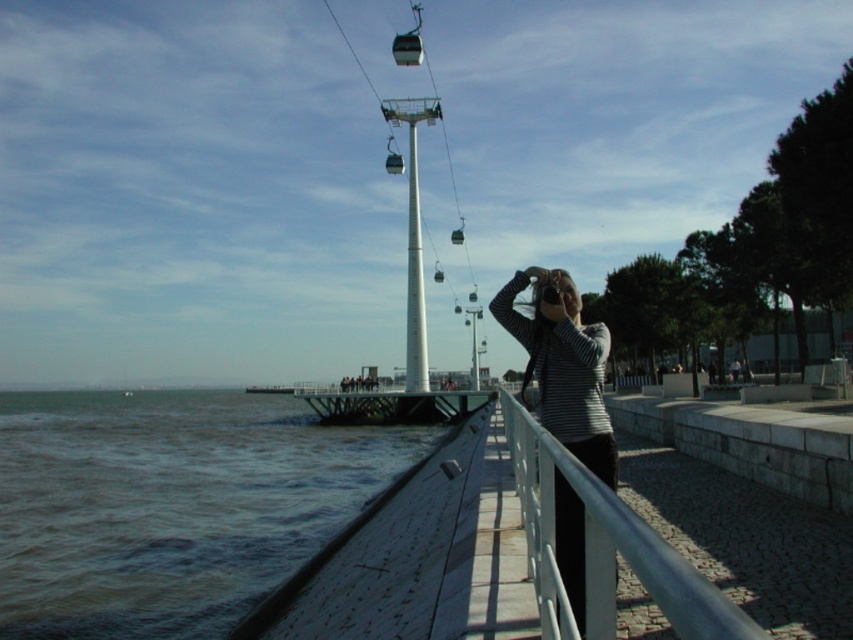
Consider the image. Does brown water at lower left appear over striped fabric at center?

No.

Between brown water at lower left and striped fabric at center, which one has less height?

striped fabric at center

Is point (276, 493) farther from viewer compared to point (563, 333)?

Yes, it is behind point (563, 333).

Identify the location of brown water at lower left. (171, 506).

Is white metal/rail at center below striped fabric at center?

Indeed, white metal/rail at center is positioned under striped fabric at center.

Is the position of white metal/rail at center more distant than that of striped fabric at center?

No, it is in front of striped fabric at center.

Which is in front, point (585, 468) or point (561, 428)?

Point (585, 468) is in front.

Locate an element on the screen. white metal/rail at center is located at coordinates (602, 547).

Between brown water at lower left and white metal/rail at center, which one has more height?

brown water at lower left is taller.

Between brown water at lower left and white metal/rail at center, which one is positioned higher?

Positioned higher is white metal/rail at center.

Which is in front, point (195, 417) or point (583, 634)?

Point (583, 634) is more forward.

Image resolution: width=853 pixels, height=640 pixels. In order to click on brown water at lower left in this screenshot , I will do `click(171, 506)`.